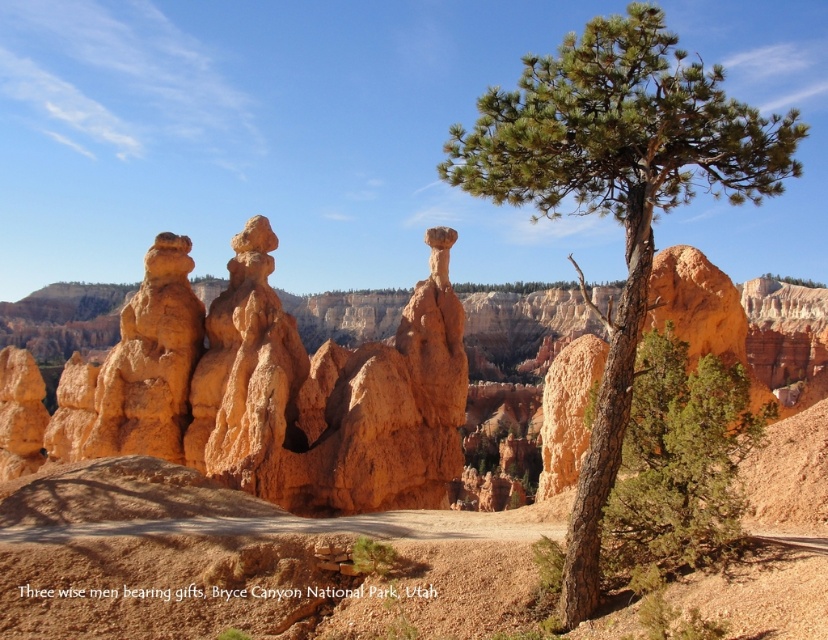
Between green rough bark tree at center and green textured tree at center, which one has less height?

With less height is green textured tree at center.

This screenshot has height=640, width=828. I want to click on green rough bark tree at center, so click(615, 192).

Is orange sandstone hoodoo at center wider than green textured tree at center?

Correct, the width of orange sandstone hoodoo at center exceeds that of green textured tree at center.

Is orange sandstone hoodoo at center smaller than green textured tree at center?

Incorrect, orange sandstone hoodoo at center is not smaller in size than green textured tree at center.

Measure the distance between point [268,474] and camera.

Point [268,474] and camera are 210.82 feet apart from each other.

At what (x,y) coordinates should I click in order to perform the action: click on orange sandstone hoodoo at center. Please return your answer as a coordinate pair (x, y). The height and width of the screenshot is (640, 828). Looking at the image, I should click on (x=278, y=388).

Which is behind, point (436, 486) or point (580, 177)?

Point (436, 486)

Is point (372, 369) in front of point (555, 118)?

No, it is behind (555, 118).

In order to click on orange sandstone hoodoo at center in this screenshot , I will do `click(278, 388)`.